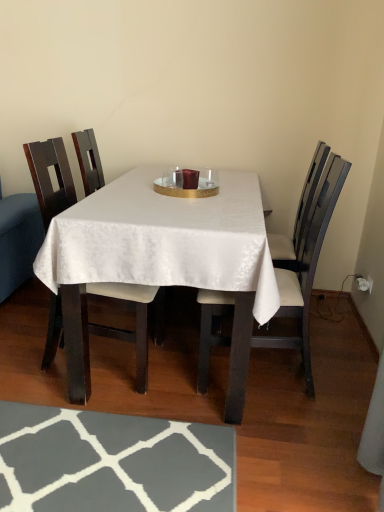
Identify the location of matte wood chair at left, which is the 2th chair from right to left. The height and width of the screenshot is (512, 384). (49, 177).

What do you see at coordinates (306, 267) in the screenshot? Image resolution: width=384 pixels, height=512 pixels. I see `wooden chair at center, which is the 2th chair in left-to-right order` at bounding box center [306, 267].

Locate an element on the screen. white satin table at center is located at coordinates (163, 259).

Does wooden chair at center, which ranks as the first chair in right-to-left order, have a larger size compared to white satin table at center?

No.

Is wooden chair at center, which is the 2th chair in left-to-right order, positioned with its back to white satin table at center?

Yes, wooden chair at center, which is the 2th chair in left-to-right order, is facing away from white satin table at center.

Considering the relative sizes of wooden chair at center, which is the 2th chair in left-to-right order, and white satin table at center in the image provided, is wooden chair at center, which is the 2th chair in left-to-right order, taller than white satin table at center?

Yes.

From a real-world perspective, is wooden chair at center, which ranks as the first chair in right-to-left order, physically above white satin table at center?

Correct, in the physical world, wooden chair at center, which ranks as the first chair in right-to-left order, is higher than white satin table at center.

Consider the image. From a real-world perspective, is white satin table at center positioned above or below wooden chair at center, which is the 2th chair in left-to-right order?

From a real-world perspective, white satin table at center is physically below wooden chair at center, which is the 2th chair in left-to-right order.

Is white satin table at center to the left or to the right of wooden chair at center, which ranks as the first chair in right-to-left order, in the image?

Based on their positions, white satin table at center is located to the left of wooden chair at center, which ranks as the first chair in right-to-left order.

Considering the positions of point (188, 259) and point (207, 319), is point (188, 259) closer or farther from the camera than point (207, 319)?

Clearly, point (188, 259) is closer to the camera than point (207, 319).

At what (x,y) coordinates should I click in order to perform the action: click on chair on the right of the white satin table at center. Please return your answer as a coordinate pair (x, y). Looking at the image, I should click on coord(306,267).

From the image's perspective, relative to wooden chair at center, which ranks as the first chair in right-to-left order, is matte wood chair at left, arranged as the 1th chair when viewed from the left, above or below?

Clearly, from the image's perspective, matte wood chair at left, arranged as the 1th chair when viewed from the left, is above wooden chair at center, which ranks as the first chair in right-to-left order.

At what (x,y) coordinates should I click in order to perform the action: click on chair behind the wooden chair at center, which is the 2th chair in left-to-right order. Please return your answer as a coordinate pair (x, y). Image resolution: width=384 pixels, height=512 pixels. Looking at the image, I should click on (49, 177).

Looking at this image, is matte wood chair at left, arranged as the 1th chair when viewed from the left, directly adjacent to wooden chair at center, which is the 2th chair in left-to-right order?

No, matte wood chair at left, arranged as the 1th chair when viewed from the left, is not with wooden chair at center, which is the 2th chair in left-to-right order.

Does point (132, 286) come farther from viewer compared to point (202, 362)?

No, (132, 286) is in front of (202, 362).

In the image, there is a white satin table at center. Where is `chair above it (from the image's perspective)`? The image size is (384, 512). chair above it (from the image's perspective) is located at coordinates (49, 177).

From the image's perspective, relative to white satin table at center, is matte wood chair at left, which is the 2th chair from right to left, above or below?

From the image's perspective, matte wood chair at left, which is the 2th chair from right to left, appears above white satin table at center.

From a real-world perspective, which is physically above, white satin table at center or matte wood chair at left, which is the 2th chair from right to left?

matte wood chair at left, which is the 2th chair from right to left.

From the image's perspective, between white satin table at center and matte wood chair at left, arranged as the 1th chair when viewed from the left, who is located below?

white satin table at center, from the image's perspective.

Locate an element on the screen. This screenshot has height=512, width=384. desk on the right of matte wood chair at left, which is the 2th chair from right to left is located at coordinates (163, 259).

Considering the relative positions of white satin table at center and matte wood chair at left, arranged as the 1th chair when viewed from the left, in the image provided, is white satin table at center to the left of matte wood chair at left, arranged as the 1th chair when viewed from the left, from the viewer's perspective?

In fact, white satin table at center is to the right of matte wood chair at left, arranged as the 1th chair when viewed from the left.

Does wooden chair at center, which is the 2th chair in left-to-right order, have a greater height compared to matte wood chair at left, which is the 2th chair from right to left?

Indeed, wooden chair at center, which is the 2th chair in left-to-right order, has a greater height compared to matte wood chair at left, which is the 2th chair from right to left.

How different are the orientations of wooden chair at center, which is the 2th chair in left-to-right order, and matte wood chair at left, arranged as the 1th chair when viewed from the left, in degrees?

They differ by 180 degrees in their facing directions.

Which is closer, (202, 312) or (42, 365)?

Point (202, 312) is closer to the camera than point (42, 365).

Locate an element on the screen. desk that is in front of the wooden chair at center, which ranks as the first chair in right-to-left order is located at coordinates (163, 259).

The image size is (384, 512). I want to click on chair located on the right of white satin table at center, so click(x=306, y=267).

Based on their spatial positions, is matte wood chair at left, arranged as the 1th chair when viewed from the left, or wooden chair at center, which ranks as the first chair in right-to-left order, closer to white satin table at center?

Among the two, wooden chair at center, which ranks as the first chair in right-to-left order, is located nearer to white satin table at center.

Considering their positions, is matte wood chair at left, which is the 2th chair from right to left, positioned further to wooden chair at center, which is the 2th chair in left-to-right order, than white satin table at center?

Among the two, matte wood chair at left, which is the 2th chair from right to left, is located further to wooden chair at center, which is the 2th chair in left-to-right order.

Estimate the real-world distances between objects in this image. Which object is closer to white satin table at center, wooden chair at center, which is the 2th chair in left-to-right order, or matte wood chair at left, which is the 2th chair from right to left?

wooden chair at center, which is the 2th chair in left-to-right order, is positioned closer to the anchor white satin table at center.

Based on their spatial positions, is white satin table at center or wooden chair at center, which ranks as the first chair in right-to-left order, further from matte wood chair at left, arranged as the 1th chair when viewed from the left?

wooden chair at center, which ranks as the first chair in right-to-left order.

From the picture: Which object lies further to the anchor point matte wood chair at left, arranged as the 1th chair when viewed from the left, wooden chair at center, which is the 2th chair in left-to-right order, or white satin table at center?

wooden chair at center, which is the 2th chair in left-to-right order, is positioned further to the anchor matte wood chair at left, arranged as the 1th chair when viewed from the left.

Considering their positions, is white satin table at center positioned further to wooden chair at center, which is the 2th chair in left-to-right order, than matte wood chair at left, which is the 2th chair from right to left?

Among the two, matte wood chair at left, which is the 2th chair from right to left, is located further to wooden chair at center, which is the 2th chair in left-to-right order.

Find the location of a particular element. desk located between matte wood chair at left, which is the 2th chair from right to left, and wooden chair at center, which ranks as the first chair in right-to-left order, in the left-right direction is located at coordinates (163, 259).